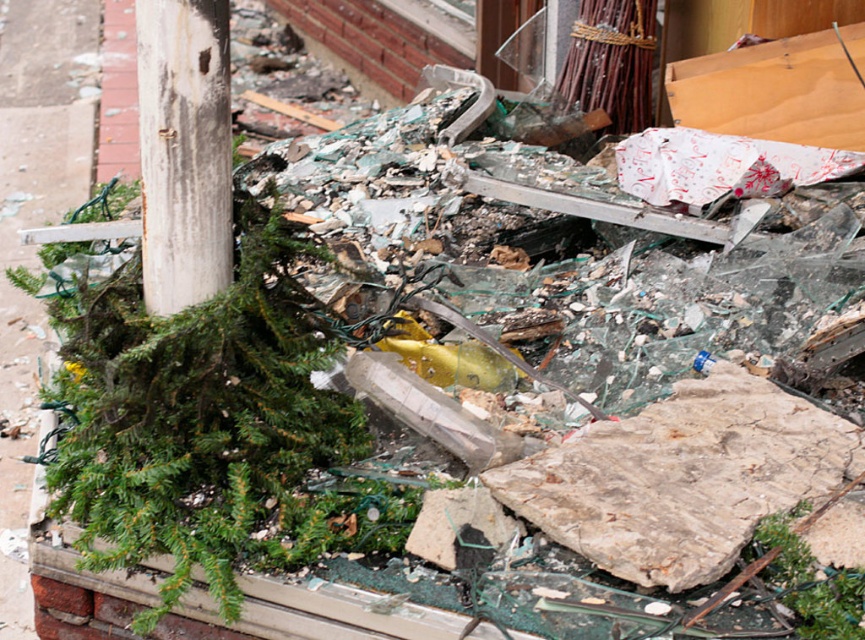
You are a delivery person trying to navigate through the area shown in the image. You need to place a large box that is 2 meters wide. Is there enough space on the brown concrete pavement at left or the white weathered wood post at upper left to place it without overlapping?

The brown concrete pavement at left might be wider than white weathered wood post at upper left, so it is possible that the brown concrete pavement at left can accommodate the 2 meter wide box, but the exact width is uncertain based on the given information.

You are standing in a disaster area and need to reach a safe zone located behind the brown concrete pavement at left. If your stride length is 0.75 meters, how many steps do you need to take to reach the pavement?

The brown concrete pavement at left is 3.04 meters away. With each step covering 0.75 meters, you would need approximately 4 steps to reach it since 3.04 divided by 0.75 is roughly 4.05, so rounding up gives 5 steps.